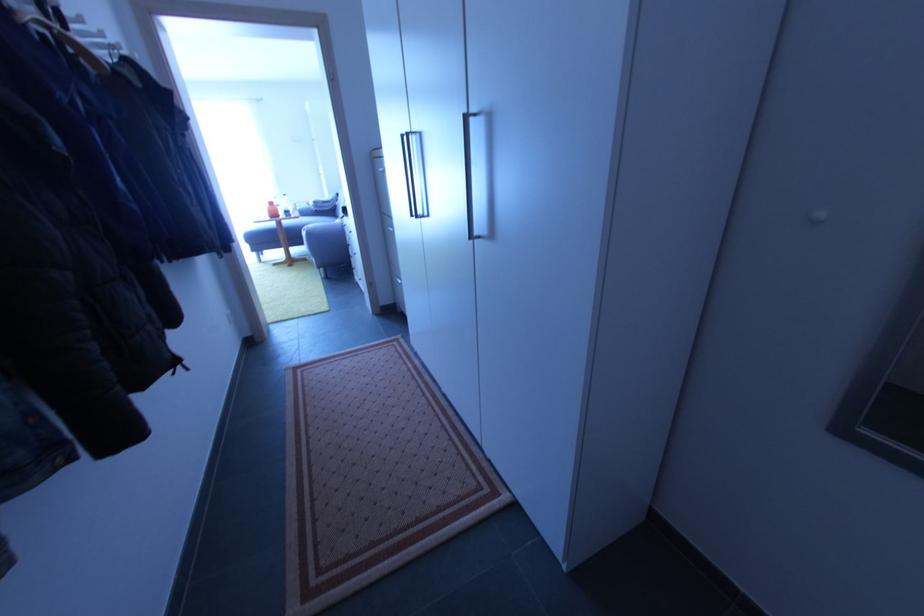
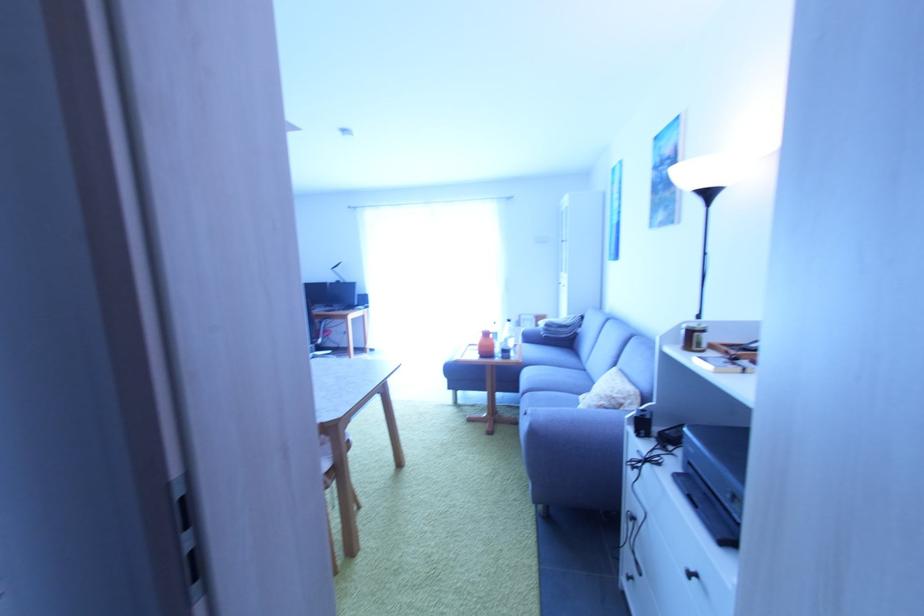
Find the pixel in the second image that matches [290,217] in the first image.

(507, 360)